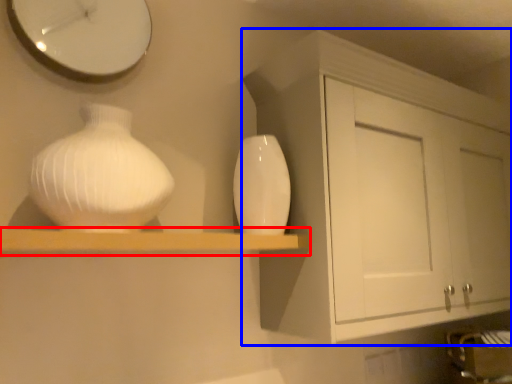
Question: Which point is further to the camera, shelf (highlighted by a red box) or cabinetry (highlighted by a blue box)?

Choices:
 (A) shelf
 (B) cabinetry

Answer: (B)